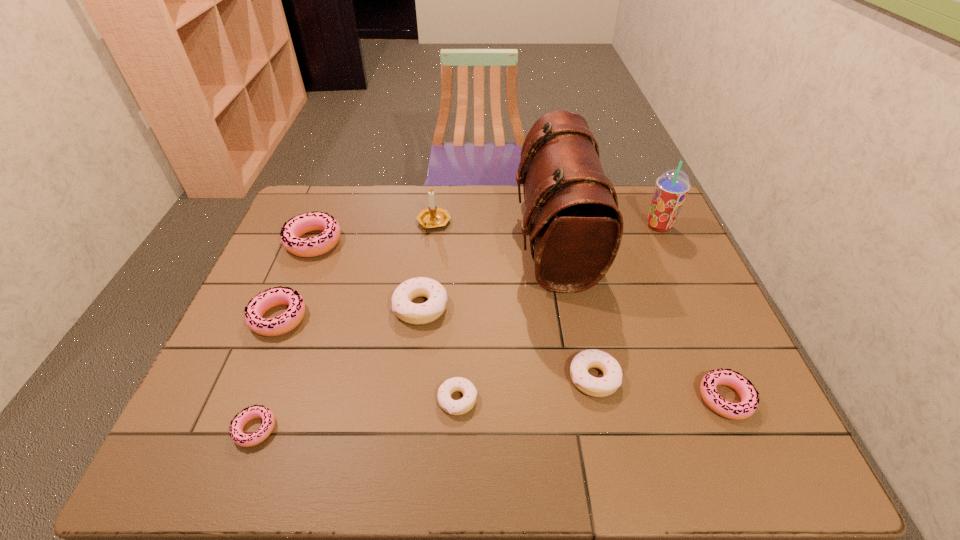
Identify the location of vacant space at the right edge. The height and width of the screenshot is (540, 960). (672, 232).

Image resolution: width=960 pixels, height=540 pixels. Find the location of `free space that is in between the biggest white doughnut and the rightmost white doughnut`. free space that is in between the biggest white doughnut and the rightmost white doughnut is located at coordinates [508, 342].

Image resolution: width=960 pixels, height=540 pixels. What are the coordinates of `vacant space that is in between the tallest object and the farthest white doughnut` in the screenshot? It's located at (488, 273).

Where is `vacant space in between the satchel and the smallest pink doughnut`? Image resolution: width=960 pixels, height=540 pixels. vacant space in between the satchel and the smallest pink doughnut is located at coordinates (405, 335).

Locate an element on the screen. This screenshot has height=540, width=960. free space between the gold candle holder and the biggest pink doughnut is located at coordinates (373, 232).

Where is `vacant area that lies between the second smallest white doughnut and the third smallest pink doughnut`? The image size is (960, 540). vacant area that lies between the second smallest white doughnut and the third smallest pink doughnut is located at coordinates (437, 348).

This screenshot has height=540, width=960. What are the coordinates of `empty location between the second biggest pink doughnut and the smallest pink doughnut` in the screenshot? It's located at (267, 374).

This screenshot has width=960, height=540. What are the coordinates of `free space between the farthest doughnut and the ninth shortest object` in the screenshot? It's located at (487, 234).

Identify which object is the closest to the third smallest pink doughnut. Please provide its 2D coordinates. Your answer should be formatted as a tuple, i.e. [(x, y)], where the tuple contains the x and y coordinates of a point satisfying the conditions above.

[(315, 221)]

Locate which object ranks fourth in proximity to the third nearest pink doughnut. Please provide its 2D coordinates. Your answer should be formatted as a tuple, i.e. [(x, y)], where the tuple contains the x and y coordinates of a point satisfying the conditions above.

[(432, 217)]